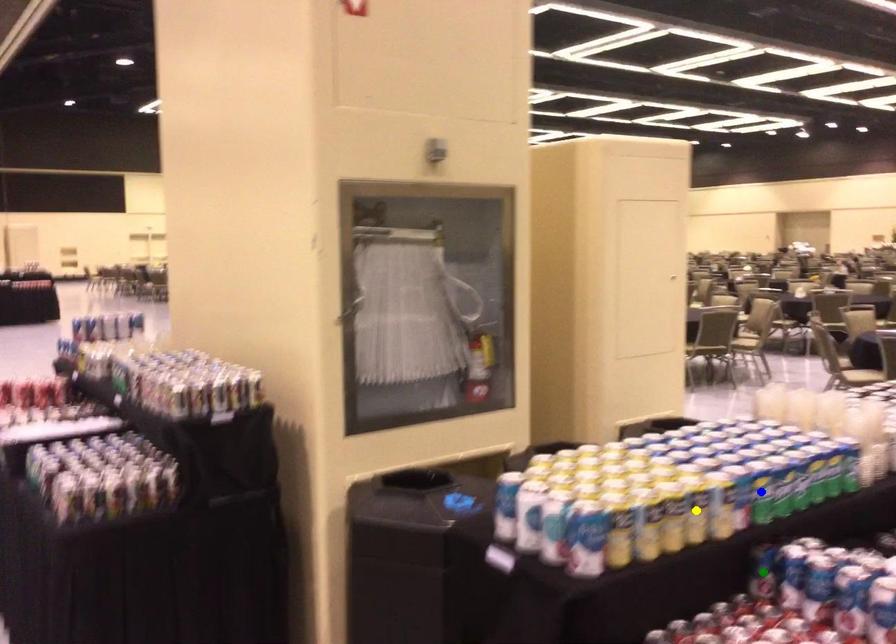
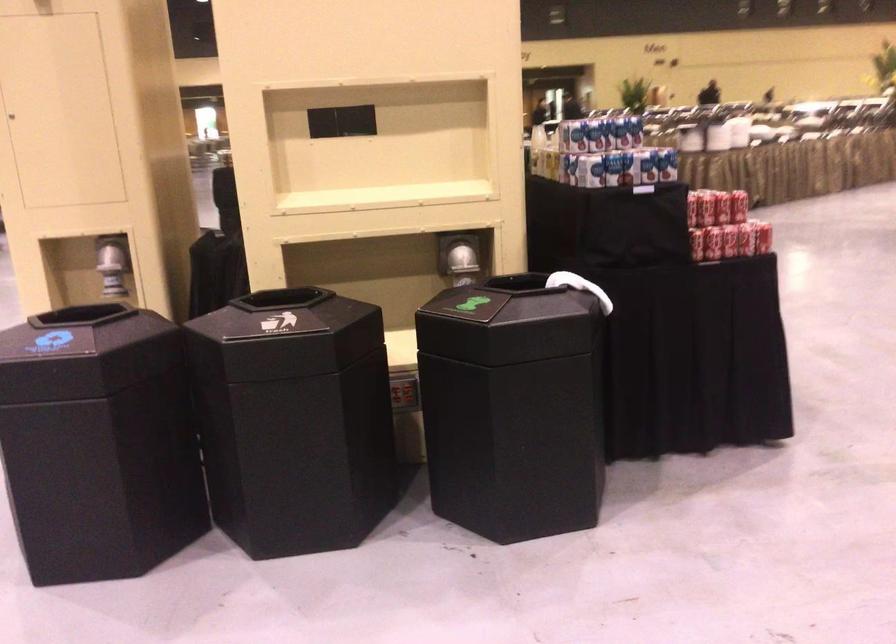
I am providing you with two images of the same scene from different viewpoints. Three points are marked in image1. Which point corresponds to a part or object that is occluded in image2?In image1, three points are marked. Which of them correspond to a part or object that is occluded in image2?Among the three points shown in image1, which one corresponds to a part or object that is no longer visible due to occlusion in image2?

yellow point, green point, blue point cannot be seen in image2.